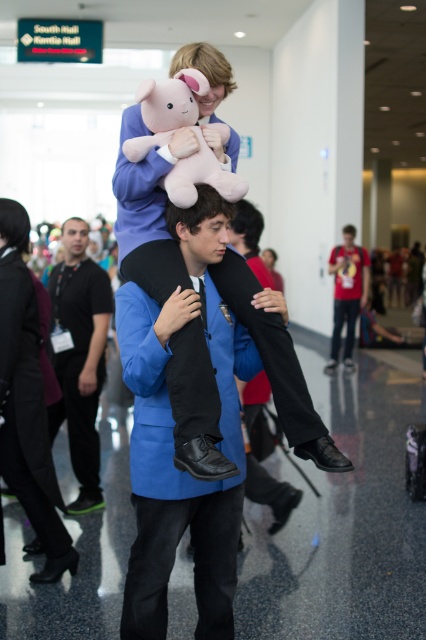
This screenshot has height=640, width=426. I want to click on black matte shirt at center, so click(80, 356).